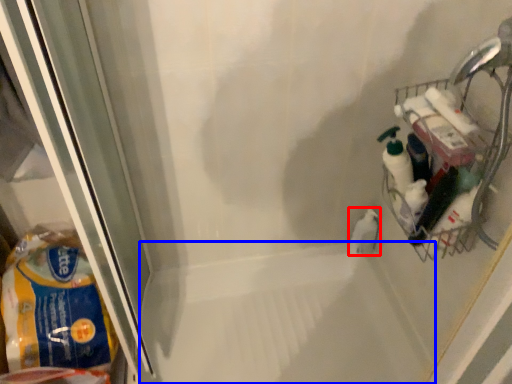
Question: Which of the following is the farthest to the observer, cleaning product (highlighted by a red box) or bath (highlighted by a blue box)?

Choices:
 (A) cleaning product
 (B) bath

Answer: (A)